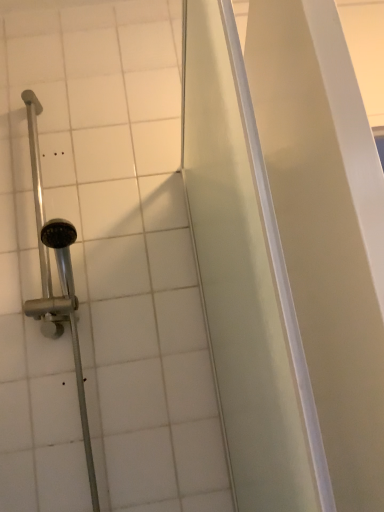
Describe the element at coordinates (288, 251) in the screenshot. The image size is (384, 512). I see `transparent glass door at right` at that location.

Identify the location of transparent glass door at right. The height and width of the screenshot is (512, 384). (288, 251).

What are the coordinates of `transparent glass door at right` in the screenshot? It's located at (288, 251).